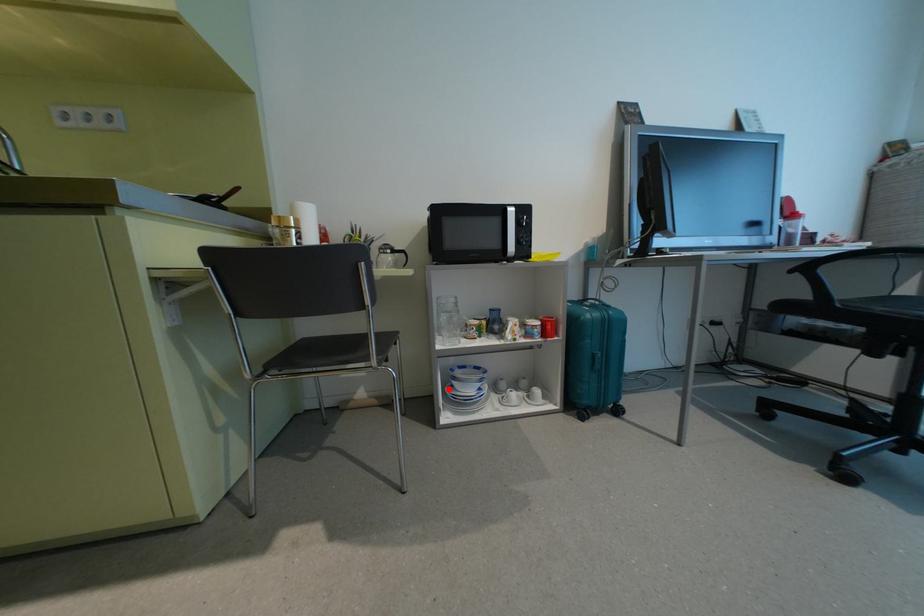
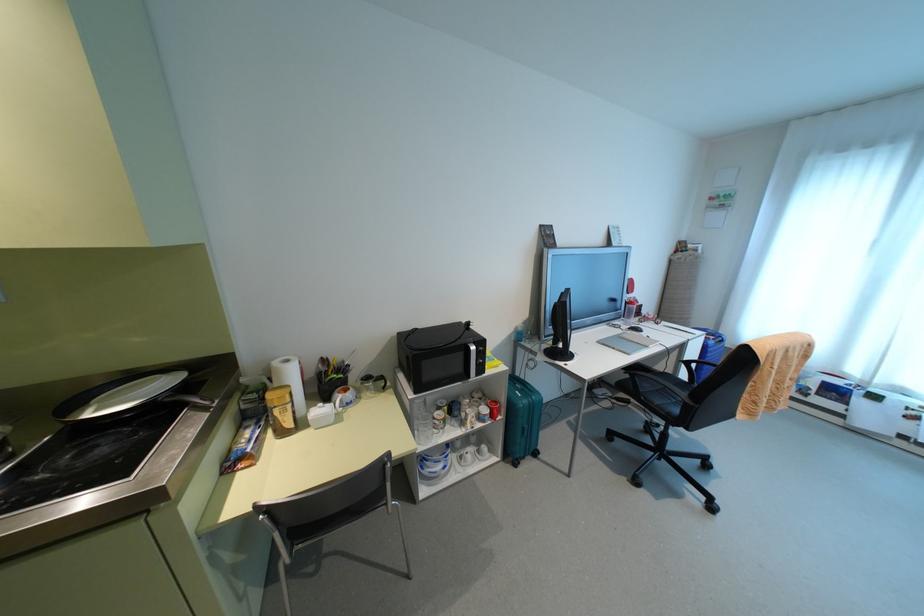
Question: A red point is marked in image1. In image2, is the corresponding 3D point closer to the camera or farther? Reply with the corresponding letter.

Choices:
 (A) The corresponding 3D point is closer.
 (B) The corresponding 3D point is farther.

Answer: (B)